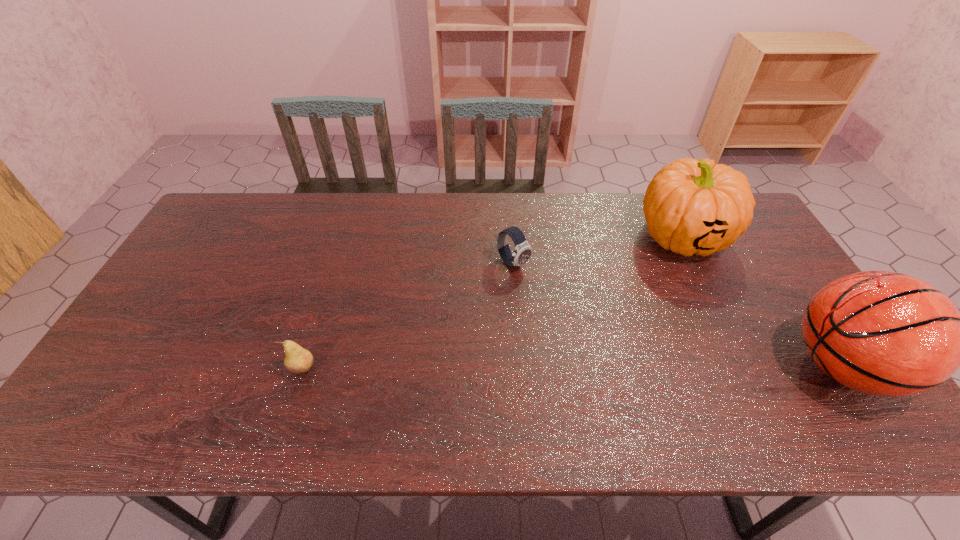
You are a GUI agent. You are given a task and a screenshot of the screen. Output one action in this format:
    pyautogui.click(x=<x>, y=<y>)
    Task: Click on the free spot located 0.220m on the face of the watch
    The width and height of the screenshot is (960, 540).
    Given the screenshot: What is the action you would take?
    pyautogui.click(x=579, y=320)

Find the location of a particular element. The height and width of the screenshot is (540, 960). free space located 0.220m on the surface of the pumpkin is located at coordinates (614, 294).

Locate an element on the screen. free point located 0.170m on the surface of the pumpkin is located at coordinates point(625,286).

Locate an element on the screen. This screenshot has width=960, height=540. vacant space located 0.150m on the surface of the pumpkin is located at coordinates (629, 282).

The image size is (960, 540). What are the coordinates of `object present at the far edge` in the screenshot? It's located at pos(692,207).

You are a GUI agent. You are given a task and a screenshot of the screen. Output one action in this format:
    pyautogui.click(x=<x>, y=<y>)
    Task: Click on the pear positioned at the near edge
    
    Given the screenshot: What is the action you would take?
    pyautogui.click(x=298, y=360)

The width and height of the screenshot is (960, 540). Identify the location of basketball present at the near edge. (883, 333).

Where is `basketball at the right edge`? basketball at the right edge is located at coordinates (883, 333).

Image resolution: width=960 pixels, height=540 pixels. I want to click on pumpkin present at the right edge, so click(692, 207).

Where is `object located at the far right corner`? Image resolution: width=960 pixels, height=540 pixels. object located at the far right corner is located at coordinates (692, 207).